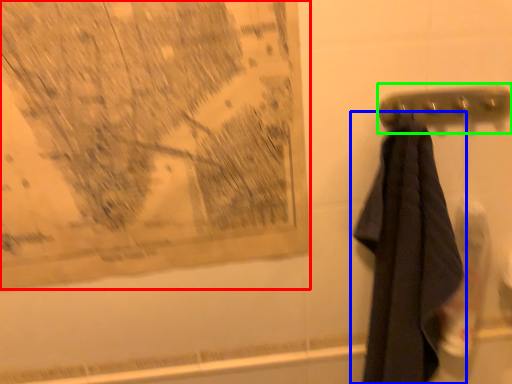
Question: Which is farther away from map (highlighted by a red box)? towel (highlighted by a blue box) or towel bar (highlighted by a green box)?

Choices:
 (A) towel
 (B) towel bar

Answer: (B)